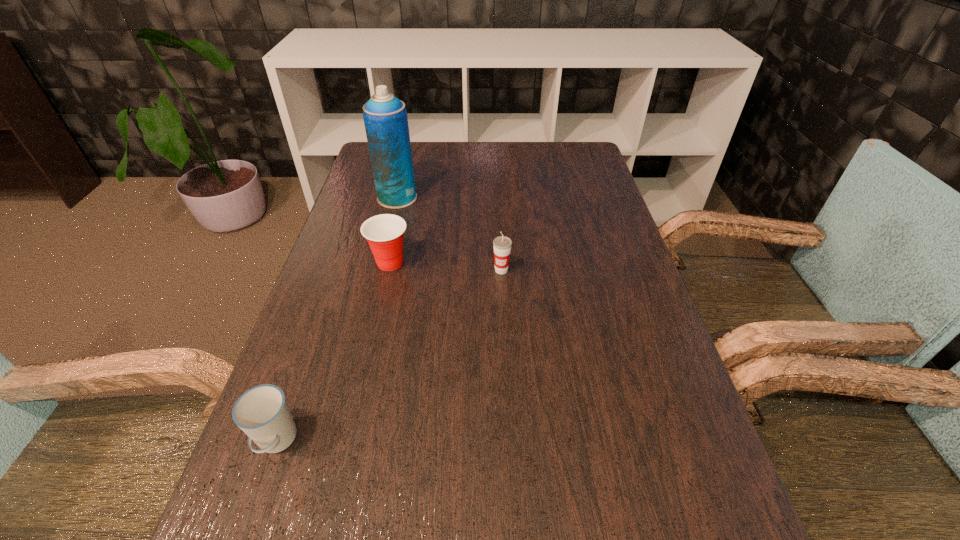
This screenshot has width=960, height=540. Identify the location of free point between the nearest cup and the aerosol can. (337, 320).

Identify the location of free space that is in between the nearest cup and the farthest object. 337,320.

The height and width of the screenshot is (540, 960). I want to click on empty space between the tallest object and the leftmost cup, so click(x=337, y=320).

Image resolution: width=960 pixels, height=540 pixels. What are the coordinates of `empty location between the rightmost cup and the farthest object` in the screenshot? It's located at (449, 234).

The height and width of the screenshot is (540, 960). I want to click on vacant point located between the second cup from left to right and the nearest object, so click(x=333, y=352).

This screenshot has height=540, width=960. I want to click on vacant space that's between the second cup from left to right and the rightmost cup, so click(445, 266).

Find the location of `object that is the third closest to the rightmost cup`. object that is the third closest to the rightmost cup is located at coordinates (262, 413).

Image resolution: width=960 pixels, height=540 pixels. In order to click on object that is the third closest one to the rightmost object in this screenshot , I will do `click(262, 413)`.

Select which cup appears as the closest to the second cup from right to left. Please provide its 2D coordinates. Your answer should be formatted as a tuple, i.e. [(x, y)], where the tuple contains the x and y coordinates of a point satisfying the conditions above.

[(502, 245)]

At what (x,y) coordinates should I click in order to perform the action: click on the closest cup to the second cup from left to right. Please return your answer as a coordinate pair (x, y). The height and width of the screenshot is (540, 960). Looking at the image, I should click on (502, 245).